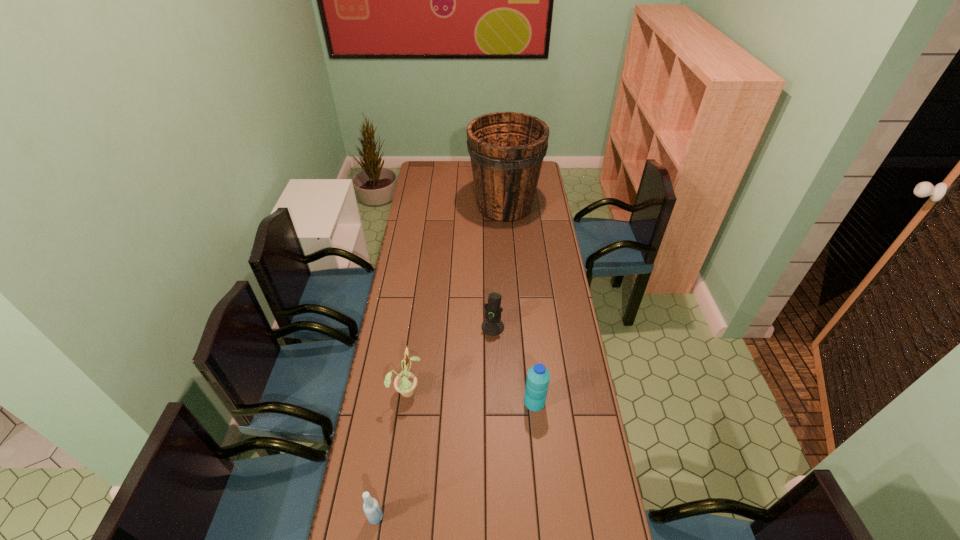
Select which object appears as the closest to the second farthest object. Please provide its 2D coordinates. Your answer should be formatted as a tuple, i.e. [(x, y)], where the tuple contains the x and y coordinates of a point satisfying the conditions above.

[(538, 377)]

Where is `vacant space that satisfies the following two spatial constraints: 1. on the front-facing side of the sunflower; 2. on the left side of the water bottle`? This screenshot has width=960, height=540. vacant space that satisfies the following two spatial constraints: 1. on the front-facing side of the sunflower; 2. on the left side of the water bottle is located at coordinates (405, 402).

Where is `vacant area that satisfies the following two spatial constraints: 1. on the front side of the microphone; 2. on the front-facing side of the sunflower`? The height and width of the screenshot is (540, 960). vacant area that satisfies the following two spatial constraints: 1. on the front side of the microphone; 2. on the front-facing side of the sunflower is located at coordinates (494, 390).

At what (x,y) coordinates should I click in order to perform the action: click on free space that satisfies the following two spatial constraints: 1. on the front side of the fourth nearest object; 2. on the front-facing side of the sunflower. Please return your answer as a coordinate pair (x, y). This screenshot has height=540, width=960. Looking at the image, I should click on (494, 390).